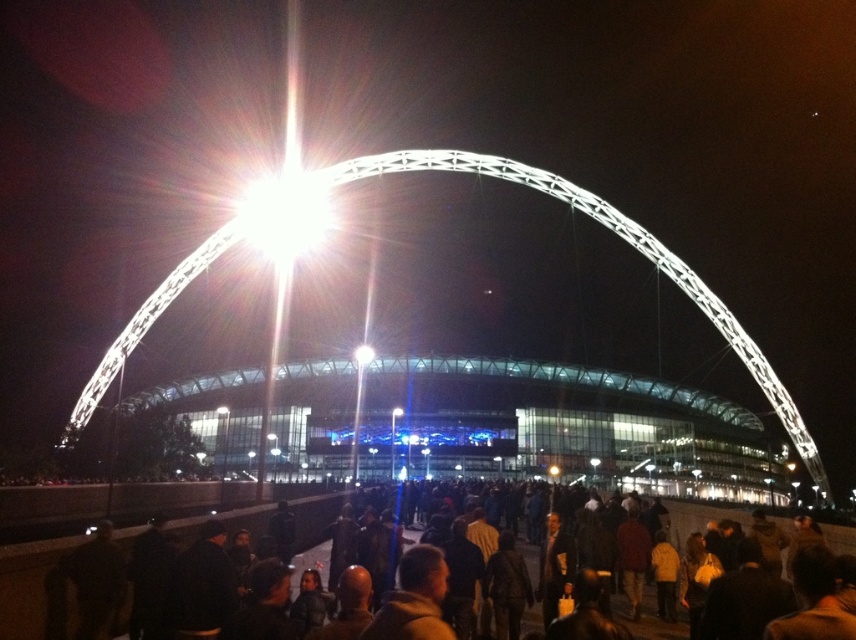
You are standing at the entrance of Wembley Stadium and see the dark brown clothing at lower center and the bright white light at center. Which object is nearer to you?

The dark brown clothing at lower center is closer to the viewer than the bright white light at center.

You are a photographer at Wembley Stadium at night. You notice the dark brown clothing at lower center and the bright white light at center. Which object is located below the other?

The dark brown clothing at lower center is positioned under bright white light at center.